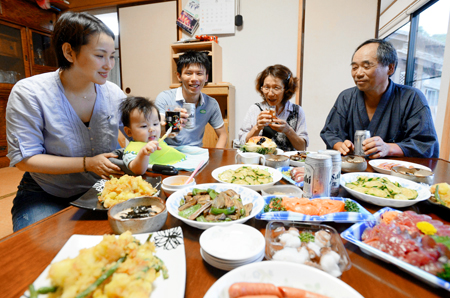
Find the location of a particular element. The height and width of the screenshot is (298, 450). white bowls of food is located at coordinates (207, 215), (248, 183), (375, 191).